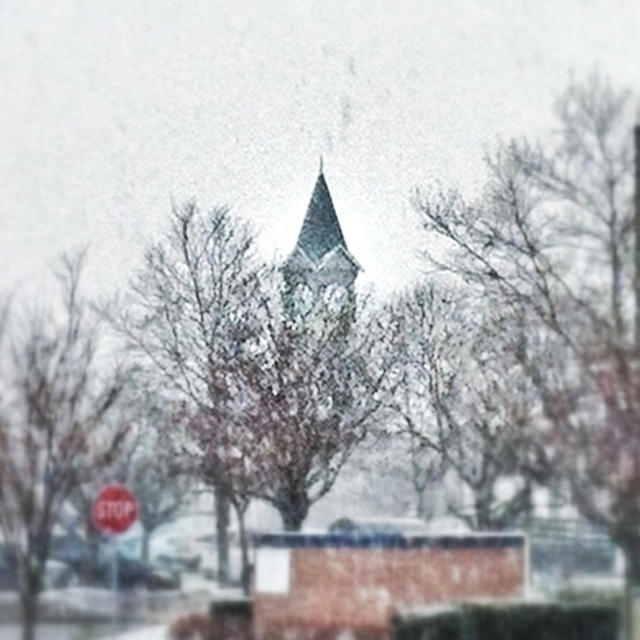
You are a pedestrian trying to see the red matte stop sign at lower left behind the smooth brown tree at lower left. Can you see the entire stop sign, or is part of it hidden by the tree?

The smooth brown tree at lower left is much taller than the red matte stop sign at lower left, so part of the stop sign is likely hidden behind the tree.